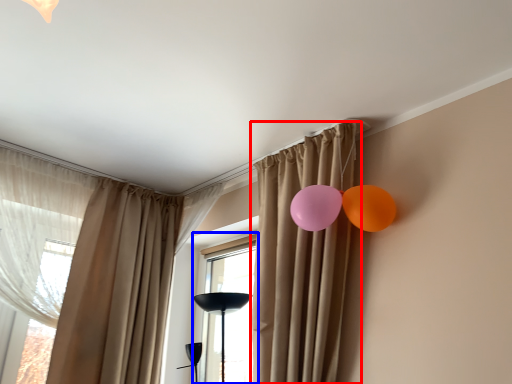
Question: Which point is further to the camera, curtain (highlighted by a red box) or window (highlighted by a blue box)?

Choices:
 (A) curtain
 (B) window

Answer: (B)